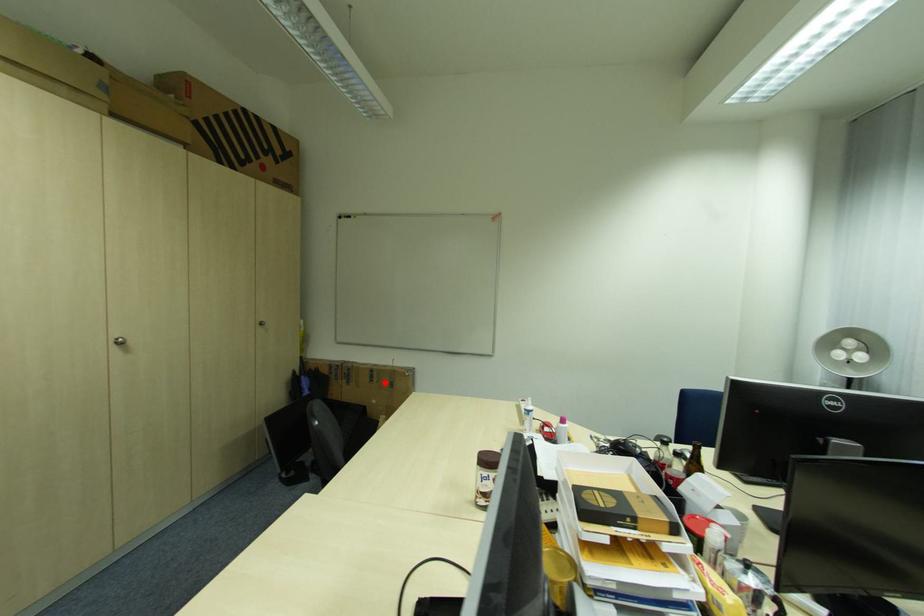
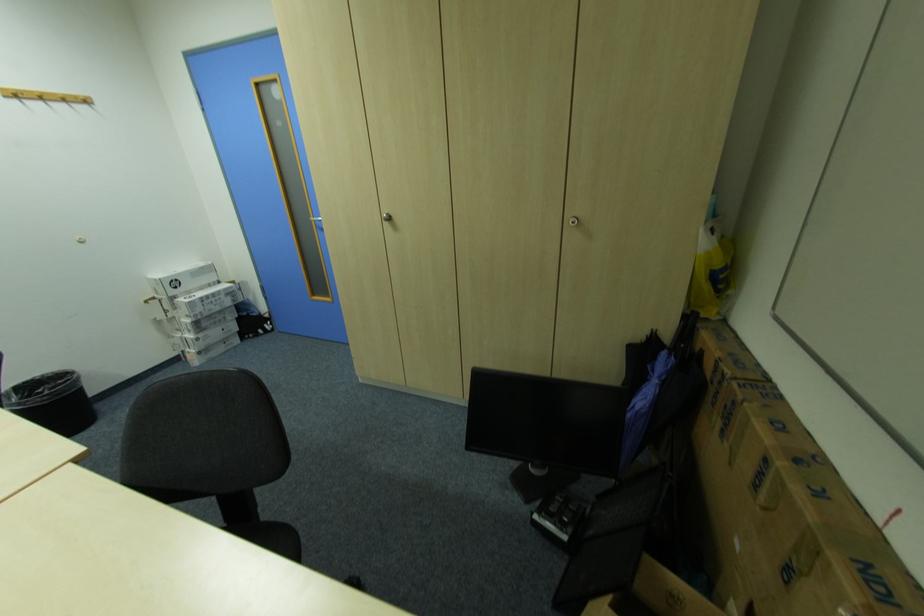
In the second image, find the point that corresponds to the highlighted location in the first image.

(772, 509)